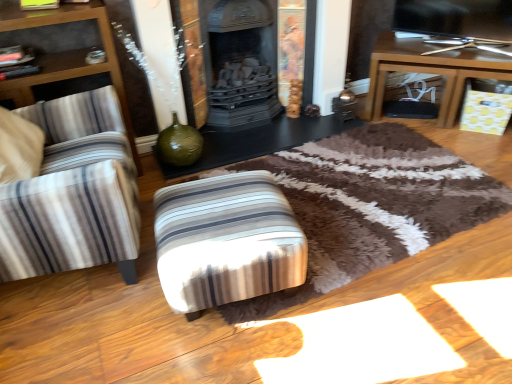
Question: From the image's perspective, is brown wooden table at right, positioned as the second table in left-to-right order, located beneath black glossy table at center, which ranks as the first table in left-to-right order?

Choices:
 (A) no
 (B) yes

Answer: (A)

Question: Does brown wooden table at right, acting as the 1th table starting from the right, appear on the left side of black glossy table at center, which is the 2th table from right to left?

Choices:
 (A) yes
 (B) no

Answer: (B)

Question: Is brown wooden table at right, acting as the 1th table starting from the right, behind black glossy table at center, which is the 2th table from right to left?

Choices:
 (A) no
 (B) yes

Answer: (B)

Question: Is brown wooden table at right, positioned as the second table in left-to-right order, oriented towards black glossy table at center, which ranks as the first table in left-to-right order?

Choices:
 (A) no
 (B) yes

Answer: (A)

Question: Is brown wooden table at right, acting as the 1th table starting from the right, thinner than black glossy table at center, which ranks as the first table in left-to-right order?

Choices:
 (A) yes
 (B) no

Answer: (B)

Question: Looking at the image, does black glossy table at center, which is the 2th table from right to left, seem bigger or smaller compared to brown wooden table at right, positioned as the second table in left-to-right order?

Choices:
 (A) small
 (B) big

Answer: (A)

Question: Is point (236, 152) positioned closer to the camera than point (384, 89)?

Choices:
 (A) closer
 (B) farther

Answer: (A)

Question: Considering the positions of black glossy table at center, which ranks as the first table in left-to-right order, and brown wooden table at right, positioned as the second table in left-to-right order, in the image, is black glossy table at center, which ranks as the first table in left-to-right order, taller or shorter than brown wooden table at right, positioned as the second table in left-to-right order,?

Choices:
 (A) short
 (B) tall

Answer: (A)

Question: Considering their positions, is black glossy table at center, which is the 2th table from right to left, located in front of or behind brown wooden table at right, positioned as the second table in left-to-right order?

Choices:
 (A) behind
 (B) front

Answer: (B)

Question: From a real-world perspective, relative to brown wooden table at right, positioned as the second table in left-to-right order, is striped fabric stool at center vertically above or below?

Choices:
 (A) above
 (B) below

Answer: (B)

Question: In terms of height, does striped fabric stool at center look taller or shorter compared to brown wooden table at right, positioned as the second table in left-to-right order?

Choices:
 (A) short
 (B) tall

Answer: (A)

Question: Looking at their shapes, would you say striped fabric stool at center is wider or thinner than brown wooden table at right, positioned as the second table in left-to-right order?

Choices:
 (A) wide
 (B) thin

Answer: (A)

Question: Considering the relative positions of striped fabric stool at center and brown wooden table at right, acting as the 1th table starting from the right, in the image provided, is striped fabric stool at center to the left or to the right of brown wooden table at right, acting as the 1th table starting from the right,?

Choices:
 (A) right
 (B) left

Answer: (B)

Question: In terms of width, does brown wooden table at right, positioned as the second table in left-to-right order, look wider or thinner when compared to striped fabric ottoman at left?

Choices:
 (A) thin
 (B) wide

Answer: (A)

Question: From the image's perspective, relative to striped fabric ottoman at left, is brown wooden table at right, acting as the 1th table starting from the right, above or below?

Choices:
 (A) below
 (B) above

Answer: (B)